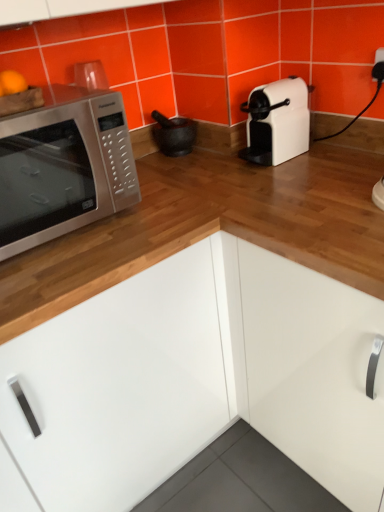
In order to click on free spot in front of satin silver microwave at left in this screenshot , I will do `click(60, 263)`.